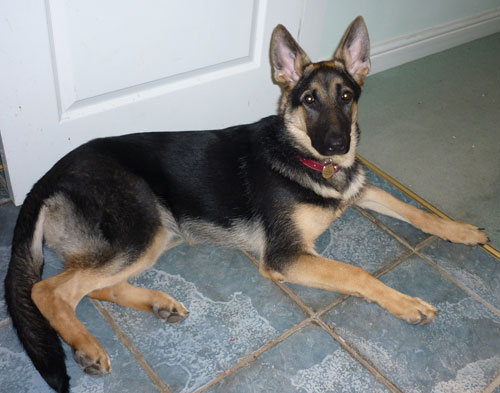
Locate an element on the screen. Image resolution: width=500 pixels, height=393 pixels. blue tile is located at coordinates (218, 327), (436, 348).